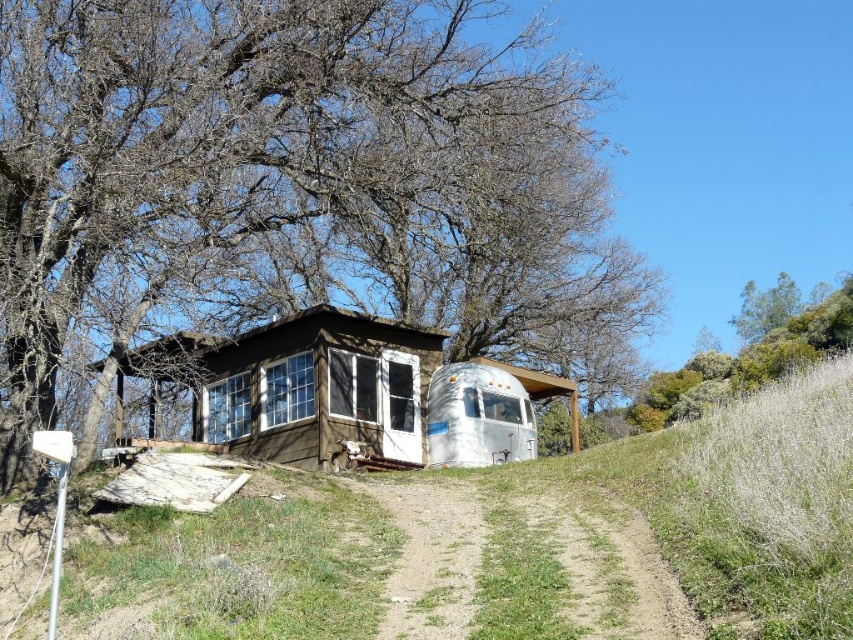
Which is above, dirt/grass at center or silver metallic trailer at center?

Positioned higher is silver metallic trailer at center.

Image resolution: width=853 pixels, height=640 pixels. What do you see at coordinates (521, 561) in the screenshot?
I see `dirt/grass at center` at bounding box center [521, 561].

The width and height of the screenshot is (853, 640). I want to click on dirt/grass at center, so click(521, 561).

Between point (564, 65) and point (267, 355), which one is positioned in front?

Point (267, 355) is in front.

Is brown textured tree at upper left closer to the viewer compared to brown wood cabin at center?

Yes, it is.

Between point (514, 212) and point (280, 365), which one is positioned behind?

The point (514, 212) is more distant.

The width and height of the screenshot is (853, 640). I want to click on brown textured tree at upper left, so click(289, 180).

Can you confirm if brown textured tree at upper left is taller than silver metallic trailer at center?

Correct, brown textured tree at upper left is much taller as silver metallic trailer at center.

Between brown textured tree at upper left and silver metallic trailer at center, which one appears on the left side from the viewer's perspective?

brown textured tree at upper left is more to the left.

Is point (97, 145) positioned behind point (500, 394)?

That is False.

The width and height of the screenshot is (853, 640). What are the coordinates of `brown textured tree at upper left` in the screenshot? It's located at (289, 180).